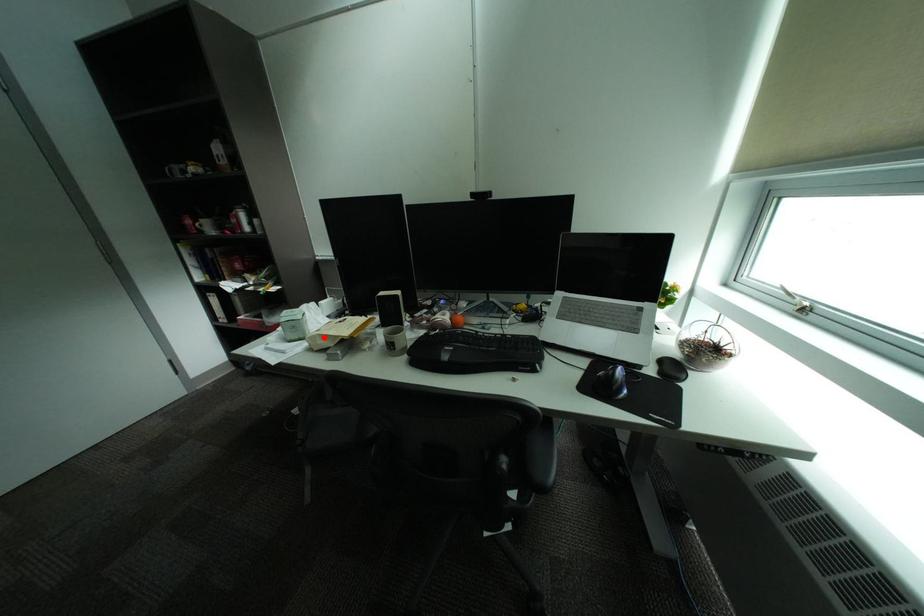
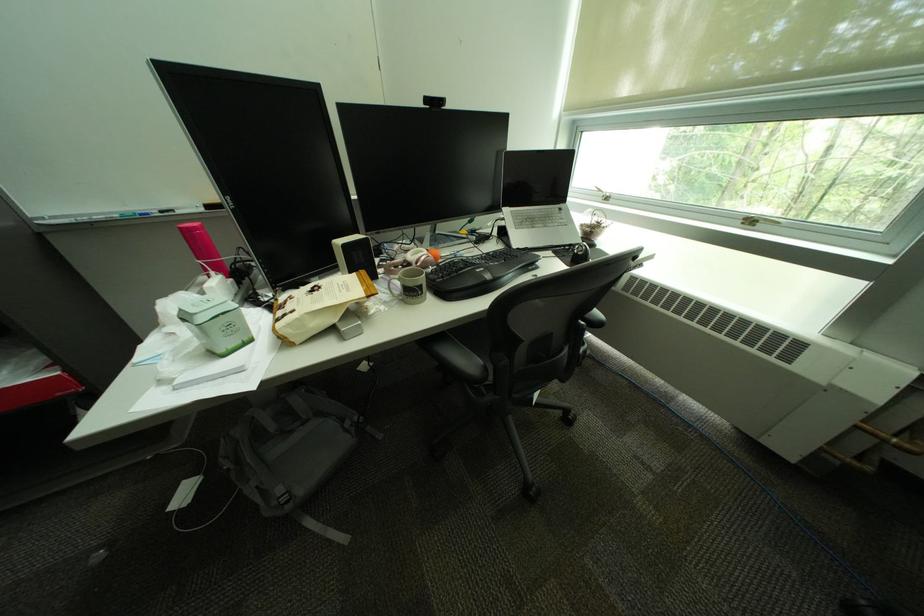
Locate, in the second image, the point that corresponds to the highlighted location in the first image.

(309, 321)